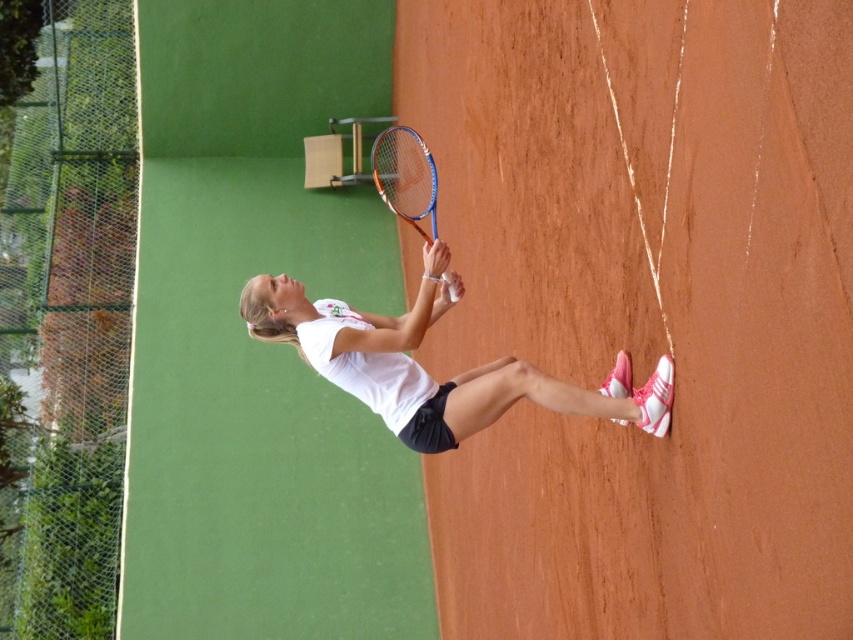
Question: Does white matte tennis racket at center appear under orange metallic tennis racket at center?

Choices:
 (A) yes
 (B) no

Answer: (A)

Question: Which of the following is the closest to the observer?

Choices:
 (A) orange metallic tennis racket at center
 (B) white matte tennis racket at center

Answer: (B)

Question: Is white matte tennis racket at center above orange metallic tennis racket at center?

Choices:
 (A) no
 (B) yes

Answer: (A)

Question: Which point is farther from the camera taking this photo?

Choices:
 (A) (357, 323)
 (B) (404, 202)

Answer: (B)

Question: Which object is farther from the camera taking this photo?

Choices:
 (A) white matte tennis racket at center
 (B) orange metallic tennis racket at center

Answer: (B)

Question: Does white matte tennis racket at center have a greater width compared to orange metallic tennis racket at center?

Choices:
 (A) yes
 (B) no

Answer: (A)